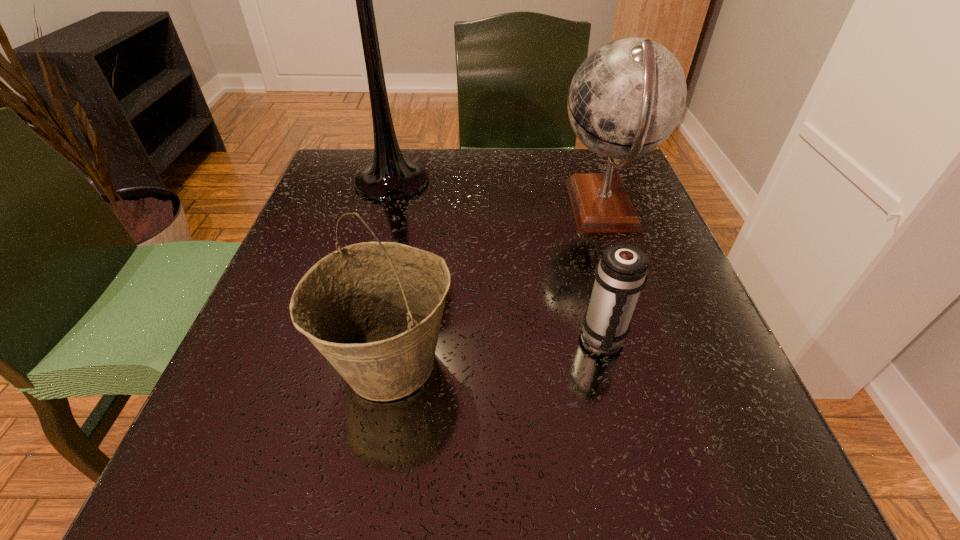
I want to click on the tallest object, so click(x=390, y=177).

Find the location of `the third shortest object`. the third shortest object is located at coordinates coord(627,97).

Where is `the second shortest object`? the second shortest object is located at coordinates (373, 309).

You are a GUI agent. You are given a task and a screenshot of the screen. Output one action in this format:
    pyautogui.click(x=<x>, y=<y>)
    Task: Click on the thermos bottle
    The width and height of the screenshot is (960, 540).
    Given the screenshot: What is the action you would take?
    pyautogui.click(x=620, y=275)

The width and height of the screenshot is (960, 540). In order to click on vacant point located on the right of the tallest object in this screenshot , I will do `click(550, 181)`.

At what (x,y) coordinates should I click in order to perform the action: click on vacant space located 0.210m at the equator of the globe. Please return your answer as a coordinate pair (x, y). Looking at the image, I should click on (x=456, y=207).

Where is `vacant space situated 0.240m at the equator of the globe`? The height and width of the screenshot is (540, 960). vacant space situated 0.240m at the equator of the globe is located at coordinates (442, 207).

The height and width of the screenshot is (540, 960). Find the location of `free space located at the equator of the globe`. free space located at the equator of the globe is located at coordinates (466, 207).

Identify the location of vacant space positioned on the right of the wine bucket. The height and width of the screenshot is (540, 960). (711, 363).

What are the coordinates of `free location located on the side with the handle of the thermos bottle` in the screenshot? It's located at (646, 498).